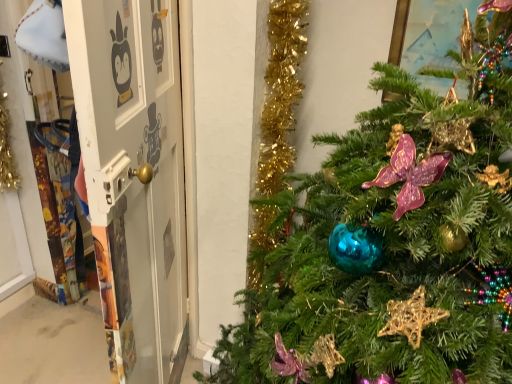
Question: In terms of height, does shiny teal ornament at center look taller or shorter compared to white glossy door at center?

Choices:
 (A) short
 (B) tall

Answer: (B)

Question: Is point (343, 223) positioned closer to the camera than point (150, 264)?

Choices:
 (A) closer
 (B) farther

Answer: (A)

Question: Visually, is shiny teal ornament at center positioned to the left or to the right of white glossy door at center?

Choices:
 (A) right
 (B) left

Answer: (A)

Question: From the image's perspective, relative to shiny teal ornament at center, is white glossy door at center above or below?

Choices:
 (A) below
 (B) above

Answer: (B)

Question: Is white glossy door at center bigger or smaller than shiny teal ornament at center?

Choices:
 (A) big
 (B) small

Answer: (B)

Question: Looking at their shapes, would you say white glossy door at center is wider or thinner than shiny teal ornament at center?

Choices:
 (A) wide
 (B) thin

Answer: (B)

Question: In the image, is white glossy door at center positioned in front of or behind shiny teal ornament at center?

Choices:
 (A) front
 (B) behind

Answer: (B)